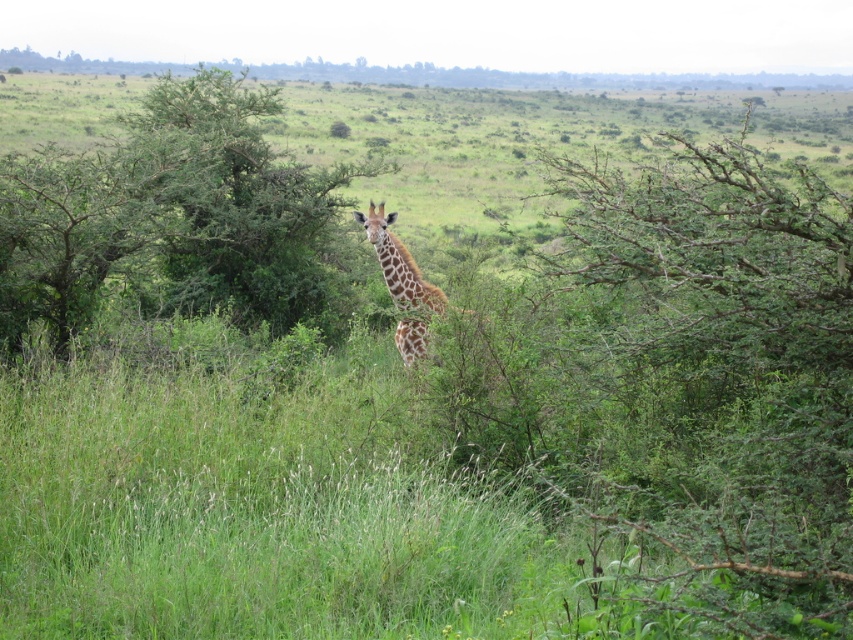
You are a photographer trying to capture the giraffe in the image. You notice a point at coordinates (723, 381). What object does this point correspond to?

The point at coordinates (723, 381) corresponds to the green leafy bush at center.

You are a photographer aiming to capture the giraffe in the image. The green leafy bush at center and the green leafy tree at center are both in the scene. Which one is closer to the camera?

The green leafy bush at center is below the green leafy tree at center, so the bush is closer to the camera than the tree.

You are a photographer trying to capture the giraffe in the image. You notice two green leafy plants at the center of the scene. Which one is bigger, the green leafy bush at center or the green leafy tree at center?

The green leafy bush at center is larger in size than the green leafy tree at center.